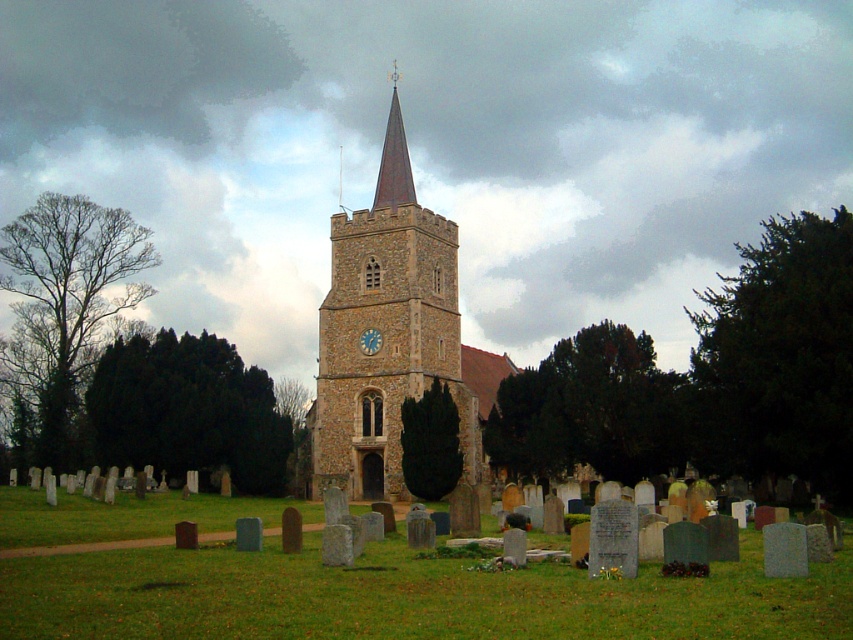
You are a tourist standing in front of the church and want to take a photo that includes both the smooth red steeple at center and the blue painted clock face at center. Based on their sizes, which object should you focus on first to ensure both are clearly visible in the frame?

The smooth red steeple at center is larger than the blue painted clock face at center, so you should focus on the smooth red steeple at center first to ensure both are clearly visible in the frame.

You are an architect analyzing the proportions of the church and its clock tower. Given that the blue painted clock face at center is part of the brown stone clock tower at center, which one would you say occupies more visual space in the image?

The brown stone clock tower at center is larger in size than the blue painted clock face at center, so it occupies more visual space in the image.

You are standing at point A, which is at coordinates (387,333). What object is located exactly at your current position?

The brown stone clock tower at center is located exactly at point A, which is at coordinates (387,333).